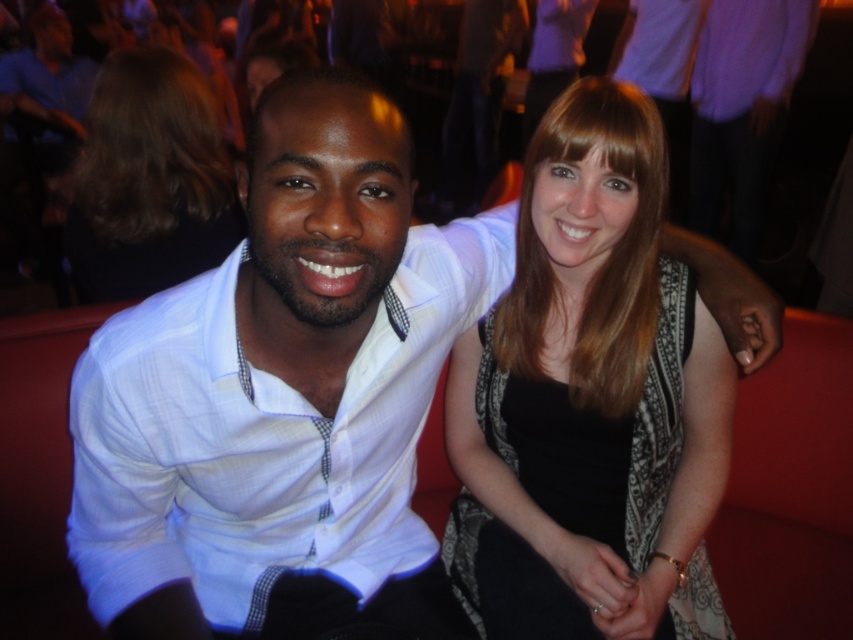
Which is more to the left, black textured dress at center or white textured shirt at left?

From the viewer's perspective, white textured shirt at left appears more on the left side.

Does black textured dress at center have a lesser height compared to white textured shirt at left?

No.

Between point (558, 156) and point (189, 312), which one is positioned in front?

Point (189, 312)

The image size is (853, 640). I want to click on black textured dress at center, so click(x=585, y=397).

Between point (291, 410) and point (225, 243), which one is positioned in front?

Point (291, 410) is more forward.

Does white textured shirt at left have a greater width compared to brown hair at upper left?

Indeed, white textured shirt at left has a greater width compared to brown hair at upper left.

Who is more distant from viewer, (323,499) or (103,284)?

Positioned behind is point (103,284).

In order to click on white textured shirt at left in this screenshot , I will do `click(264, 438)`.

Is black textured dress at center closer to the viewer compared to brown hair at upper left?

Yes, black textured dress at center is closer to the viewer.

Identify the location of black textured dress at center. (585, 397).